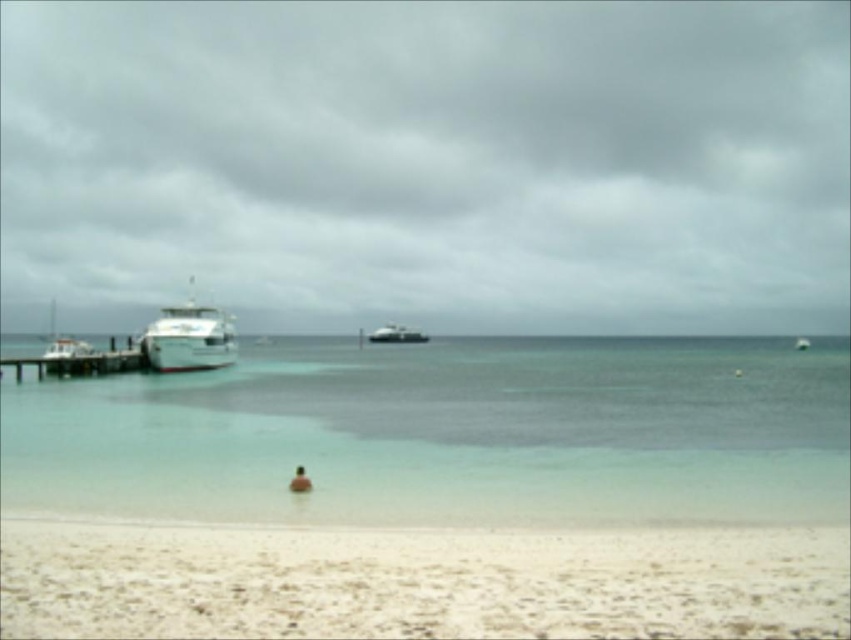
Based on the photo, you are a painter setting up your easel on the beach. You want to paint the white wood dock at left and the metallic silver boat at center. Which object should you position your easel closer to if you want both to be clearly visible in your painting without one being too small?

You should position your easel closer to the white wood dock at left because it has a lesser width compared to the metallic silver boat at center, making it appear smaller from a distance. By moving closer, you can ensure both objects are proportionally represented in your painting.

Based on the photo, you are a marine biologist studying the coastal area. You need to determine which area has a greater width between the clear water at center and the white sandy beach at lower center. Based on the scene, which one is wider?

The clear water at center is wider than the white sandy beach at lower center according to the description provided.